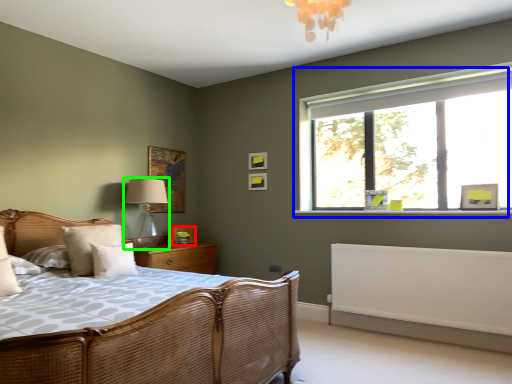
Question: Based on their relative distances, which object is farther from picture frame (highlighted by a red box)? Choose from window (highlighted by a blue box) and table lamp (highlighted by a green box).

Choices:
 (A) window
 (B) table lamp

Answer: (A)